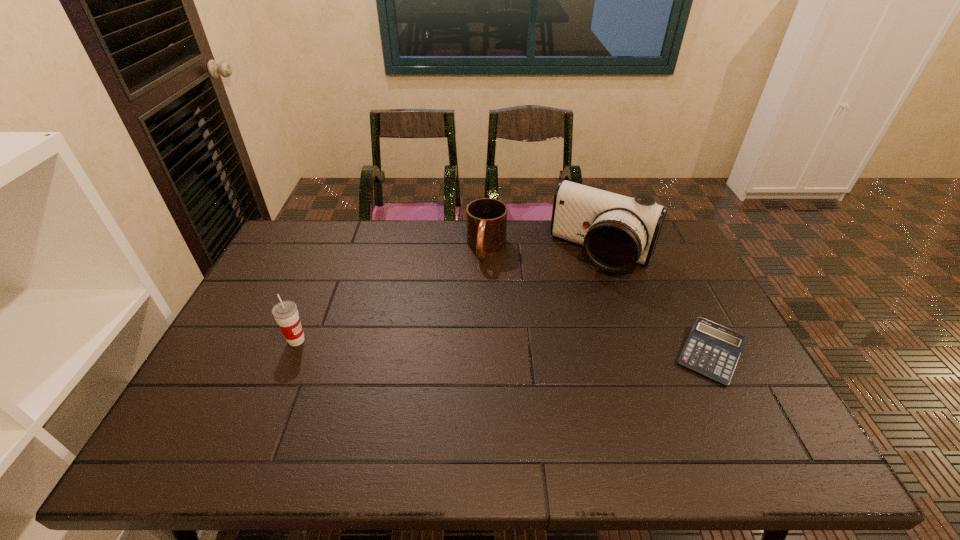
Locate an element on the screen. The height and width of the screenshot is (540, 960). object positioned at the far right corner is located at coordinates (616, 231).

Locate an element on the screen. The height and width of the screenshot is (540, 960). free space at the far edge is located at coordinates (375, 248).

Where is `vacant region at the near edge of the desktop`? vacant region at the near edge of the desktop is located at coordinates (473, 411).

Locate an element on the screen. The width and height of the screenshot is (960, 540). vacant space at the left edge is located at coordinates (260, 358).

The width and height of the screenshot is (960, 540). In the image, there is a desktop. In order to click on free space at the right edge in this screenshot , I will do `click(683, 343)`.

The image size is (960, 540). In the image, there is a desktop. What are the coordinates of `vacant space at the far left corner` in the screenshot? It's located at (285, 261).

In the image, there is a desktop. Where is `free space at the near left corner`? The width and height of the screenshot is (960, 540). free space at the near left corner is located at coordinates (229, 390).

The height and width of the screenshot is (540, 960). Find the location of `free space between the shortest object and the mug`. free space between the shortest object and the mug is located at coordinates (599, 301).

This screenshot has width=960, height=540. What are the coordinates of `vacant region between the leftmost object and the third tallest object` in the screenshot? It's located at pyautogui.click(x=392, y=294).

Locate an element on the screen. vacant area between the camcorder and the calculator is located at coordinates (656, 303).